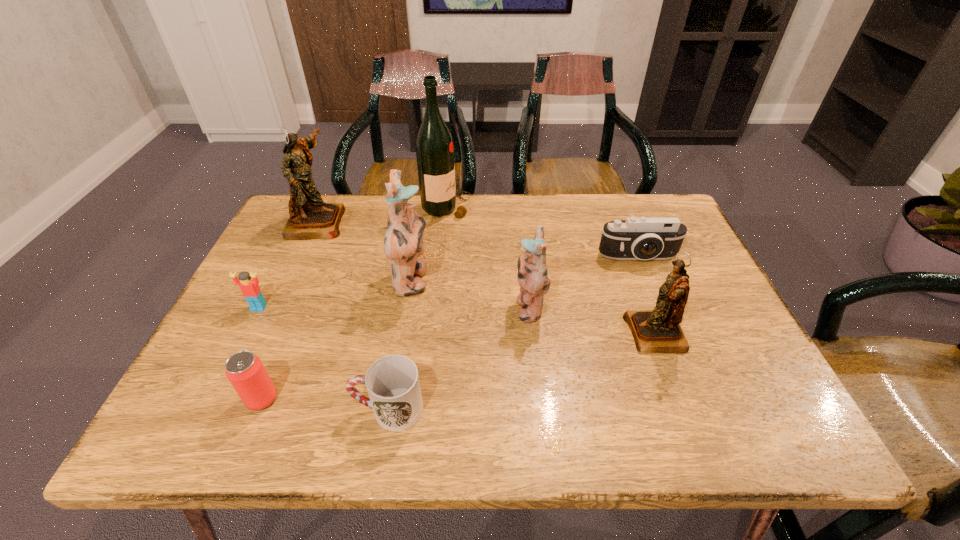
Locate an element on the screen. This screenshot has height=540, width=960. free spot located 0.060m on the front-facing side of the right pink figurine is located at coordinates (489, 307).

Where is `vacant space located on the front-facing side of the right pink figurine`? The height and width of the screenshot is (540, 960). vacant space located on the front-facing side of the right pink figurine is located at coordinates (388, 307).

The height and width of the screenshot is (540, 960). I want to click on free space located 0.050m on the front-facing side of the right pink figurine, so click(493, 307).

You are a GUI agent. You are given a task and a screenshot of the screen. Output one action in this format:
    pyautogui.click(x=<x>, y=<y>)
    Task: Click on the free location located 0.270m on the front lens of the camera
    
    Given the screenshot: What is the action you would take?
    pyautogui.click(x=677, y=353)

Identify the location of vacant area situated on the back of the beer can. (276, 365).

Where is `vacant space located on the face of the Lego`? The image size is (960, 540). vacant space located on the face of the Lego is located at coordinates (200, 427).

Locate an element on the screen. vacant space located 0.090m on the handle side of the red cup is located at coordinates (307, 409).

This screenshot has height=540, width=960. Find the location of `blank space located 0.290m on the handle side of the red cup`. blank space located 0.290m on the handle side of the red cup is located at coordinates [x=204, y=409].

Where is `vacant space located 0.150m on the handle side of the red cup`? This screenshot has width=960, height=540. vacant space located 0.150m on the handle side of the red cup is located at coordinates (276, 409).

Where is `wine bottle that is at the far edge`? This screenshot has height=540, width=960. wine bottle that is at the far edge is located at coordinates (434, 147).